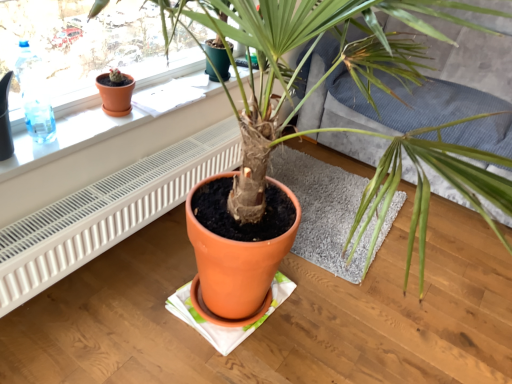
Image resolution: width=512 pixels, height=384 pixels. I want to click on blank space situated above terracotta pot at upper left (from a real-world perspective), so click(96, 117).